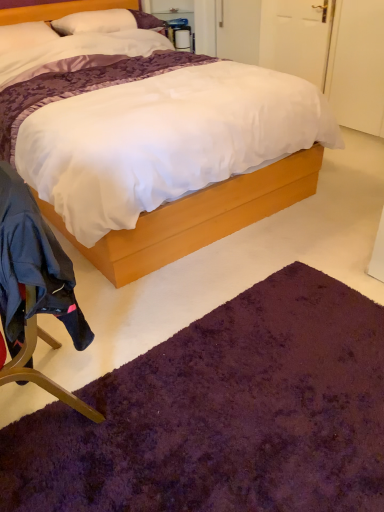
Question: From a real-world perspective, is white soft pillow at upper left above or below white matte door at upper right?

Choices:
 (A) above
 (B) below

Answer: (A)

Question: Is white soft pillow at upper left inside the boundaries of white matte door at upper right, or outside?

Choices:
 (A) inside
 (B) outside

Answer: (B)

Question: Which of these objects is positioned closest to the purple shaggy rug at lower center?

Choices:
 (A) dark blue fabric chair at lower left
 (B) white soft pillow at upper left
 (C) purple plush rug at lower center
 (D) white matte door at upper right

Answer: (A)

Question: Based on their relative distances, which object is nearer to the white soft pillow at upper left?

Choices:
 (A) purple plush rug at lower center
 (B) purple shaggy rug at lower center
 (C) dark blue fabric chair at lower left
 (D) white matte door at upper right

Answer: (D)